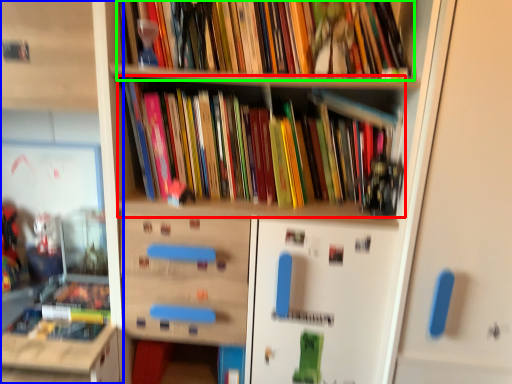
Question: Which object is positioned farthest from book (highlighted by a red box)? Select from shelf (highlighted by a blue box) and book (highlighted by a green box).

Choices:
 (A) shelf
 (B) book

Answer: (A)